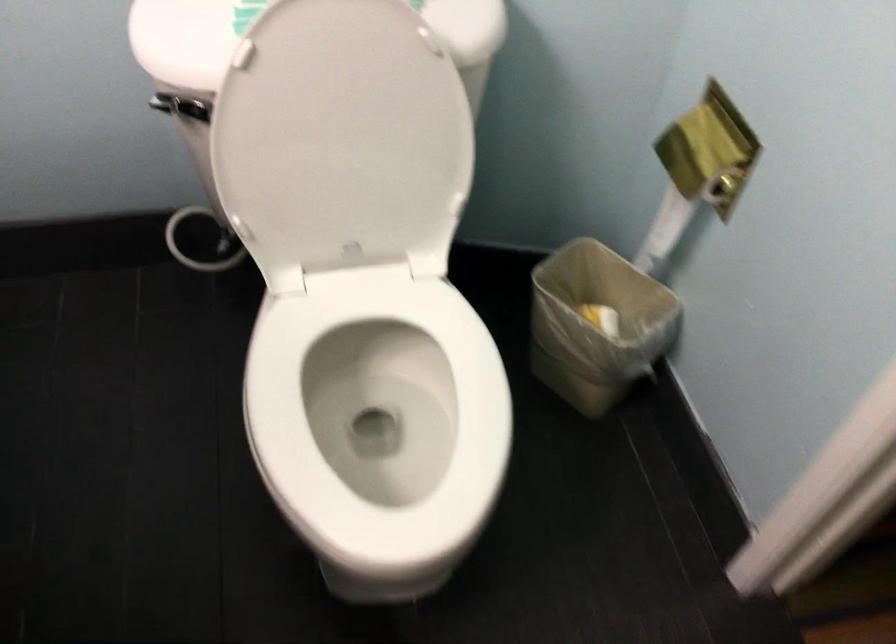
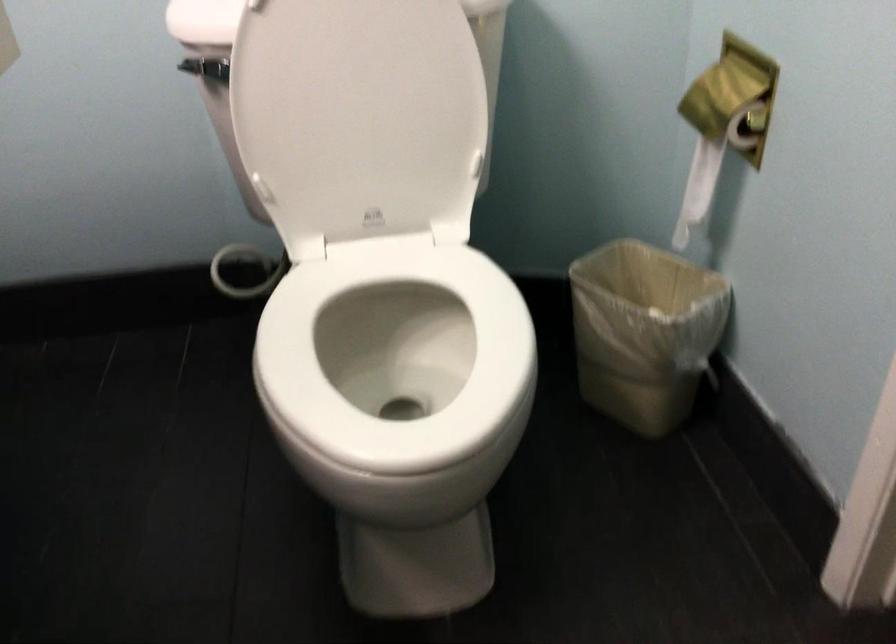
Where in the second image is the point corresponding to point 345,161 from the first image?

(359, 114)